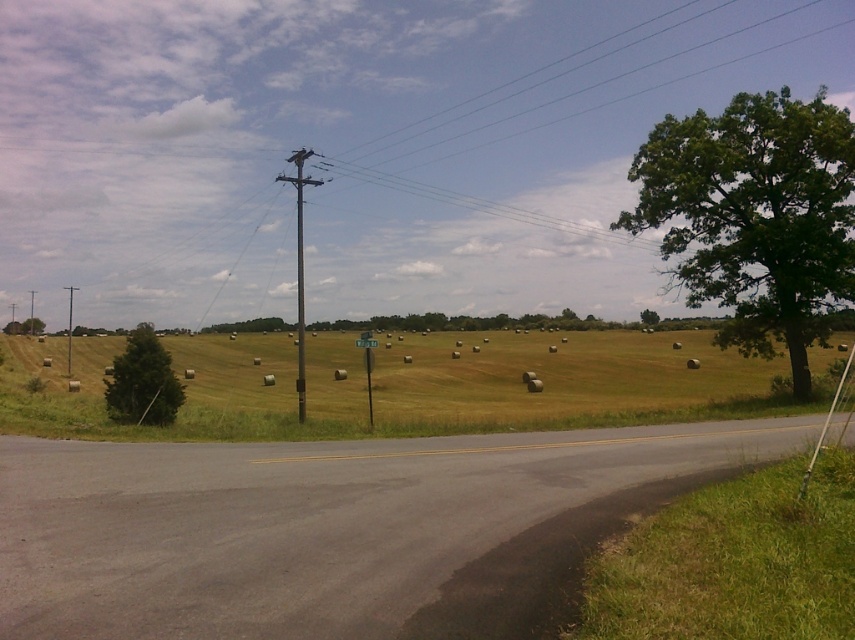
You are a painter setting up your easel to capture the rural landscape. You want to place your easel so that both the brown wooden telegraph pole at center and the brushed metal telegraph pole at left are visible in your painting. Which pole should you position closer to the left edge of your canvas to maintain their correct spatial relationship?

You should position the brushed metal telegraph pole at left closer to the left edge of your canvas because the brown wooden telegraph pole at center is to the right of it, ensuring their spatial relationship is accurately represented.

You are a photographer setting up equipment on the paved road. You notice the brushed metal telegraph pole at left and the green leafy tree at center. Which object is blocking the sunlight from reaching the telegraph pole?

The green leafy tree at center is blocking sunlight from reaching the brushed metal telegraph pole at left because the telegraph pole is positioned under the tree.

You are a bird looking for a higher perch. You see the brown wooden telegraph pole at center and the brushed metal telegraph pole at left. Which one should you choose to get a better view?

The brown wooden telegraph pole at center is taller than the brushed metal telegraph pole at left, so you should choose the brown wooden telegraph pole at center to get a better view.